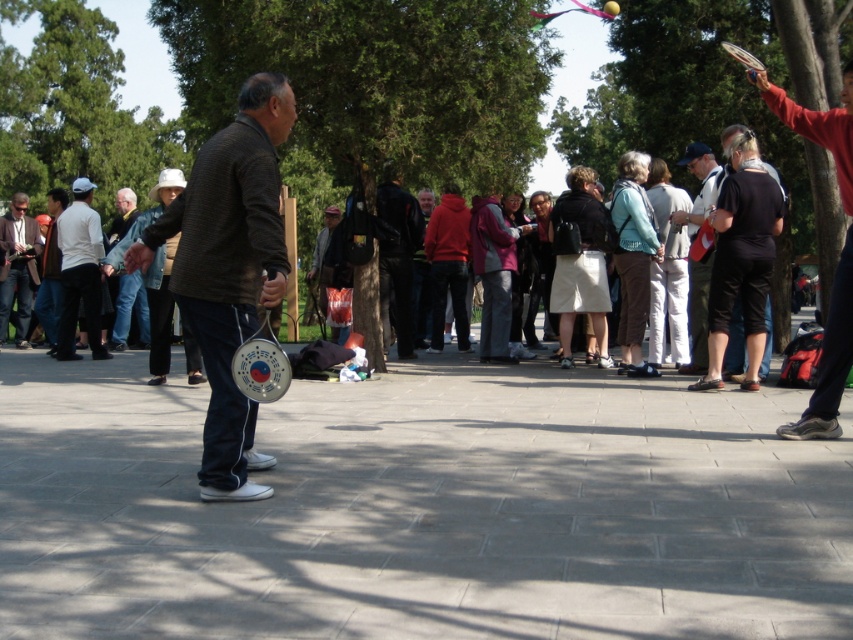
Locate an element on the screen. The height and width of the screenshot is (640, 853). reddish-brown leather jacket at right is located at coordinates (830, 358).

Is reddish-brown leather jacket at right taller than dark gray sweater at left?

Correct, reddish-brown leather jacket at right is much taller as dark gray sweater at left.

Which is behind, point (838, 140) or point (15, 224)?

The point (15, 224) is more distant.

I want to click on reddish-brown leather jacket at right, so click(830, 358).

Which of these two, camouflage pants at center or dark gray sweater at left, stands taller?

camouflage pants at center

Who is more distant from viewer, (714, 164) or (15, 240)?

Point (15, 240)

Locate an element on the screen. camouflage pants at center is located at coordinates (700, 188).

Which is more to the left, dark gray sweater at center or camouflage pants at center?

dark gray sweater at center is more to the left.

Where is `dark gray sweater at center`? The image size is (853, 640). dark gray sweater at center is located at coordinates (229, 269).